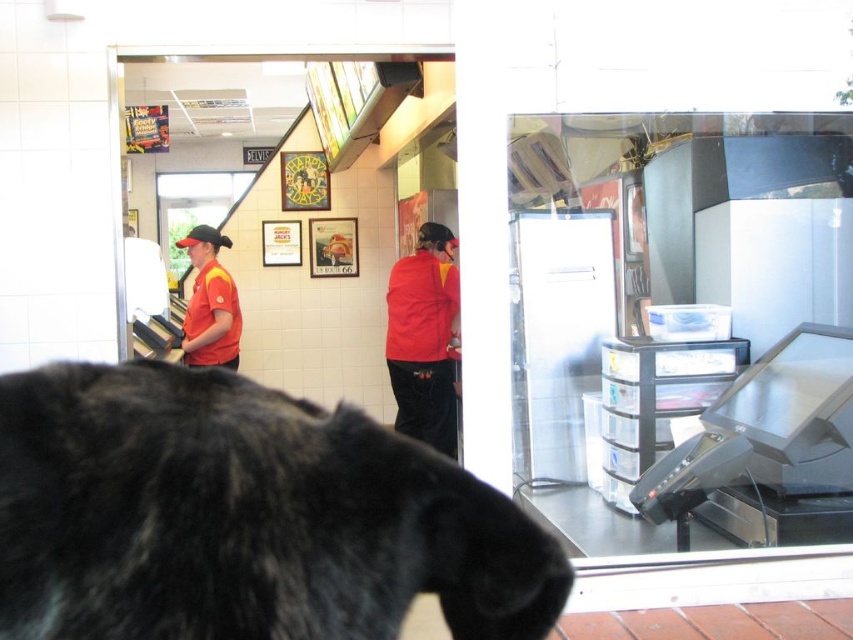
Does red matte uniform at center lie in front of matte red shirt at left?

No, it is behind matte red shirt at left.

Which of these two, red matte uniform at center or matte red shirt at left, stands shorter?

matte red shirt at left is shorter.

Image resolution: width=853 pixels, height=640 pixels. Find the location of `red matte uniform at center`. red matte uniform at center is located at coordinates (424, 339).

I want to click on red matte uniform at center, so click(x=424, y=339).

Can you confirm if transparent plastic drawer at center is taller than matte red shirt at left?

Yes, transparent plastic drawer at center is taller than matte red shirt at left.

At what (x,y) coordinates should I click in order to perform the action: click on transparent plastic drawer at center. Please return your answer as a coordinate pair (x, y). This screenshot has height=640, width=853. Looking at the image, I should click on (680, 312).

Does transparent plastic screen door at center appear over matte red shirt at left?

Actually, transparent plastic screen door at center is below matte red shirt at left.

Is point (582, 429) positioned after point (189, 321)?

No, it is in front of (189, 321).

This screenshot has height=640, width=853. What are the coordinates of `transparent plastic screen door at center` in the screenshot? It's located at (556, 333).